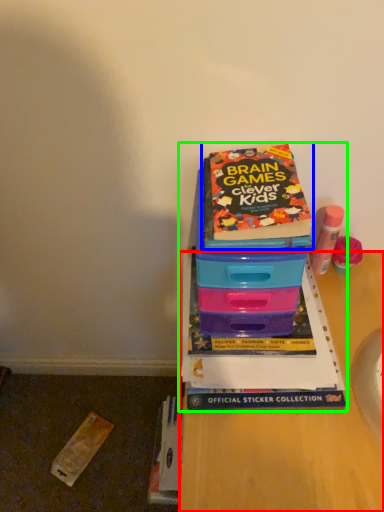
Question: Which object is the closest to the desk (highlighted by a red box)? Choose among these: book (highlighted by a blue box) or book (highlighted by a green box).

Choices:
 (A) book
 (B) book

Answer: (B)